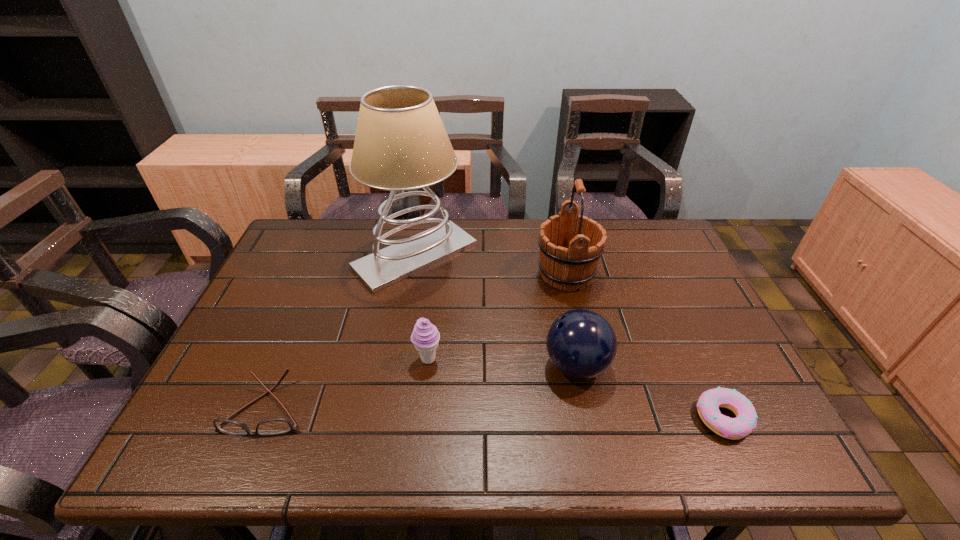
Where is `object situated at the right edge`? This screenshot has width=960, height=540. object situated at the right edge is located at coordinates (708, 404).

This screenshot has width=960, height=540. What are the coordinates of `object located in the near left corner section of the desktop` in the screenshot? It's located at (276, 426).

Identify the location of object present at the near right corner. (708, 404).

Locate an element on the screen. The height and width of the screenshot is (540, 960). free space at the far edge is located at coordinates (480, 228).

Where is `free point at the near edge`? This screenshot has width=960, height=540. free point at the near edge is located at coordinates click(x=426, y=436).

Where is `vacant region at the left edge of the desktop`? Image resolution: width=960 pixels, height=540 pixels. vacant region at the left edge of the desktop is located at coordinates (207, 421).

Find the location of `free space at the right edge`. free space at the right edge is located at coordinates (661, 269).

Where is `vacant space at the far left corner`? vacant space at the far left corner is located at coordinates (335, 221).

Where is `vacant space at the near left corner of the desktop`? The image size is (960, 540). vacant space at the near left corner of the desktop is located at coordinates (216, 454).

Where is `vacant space at the far right corner`? Image resolution: width=960 pixels, height=540 pixels. vacant space at the far right corner is located at coordinates (660, 244).